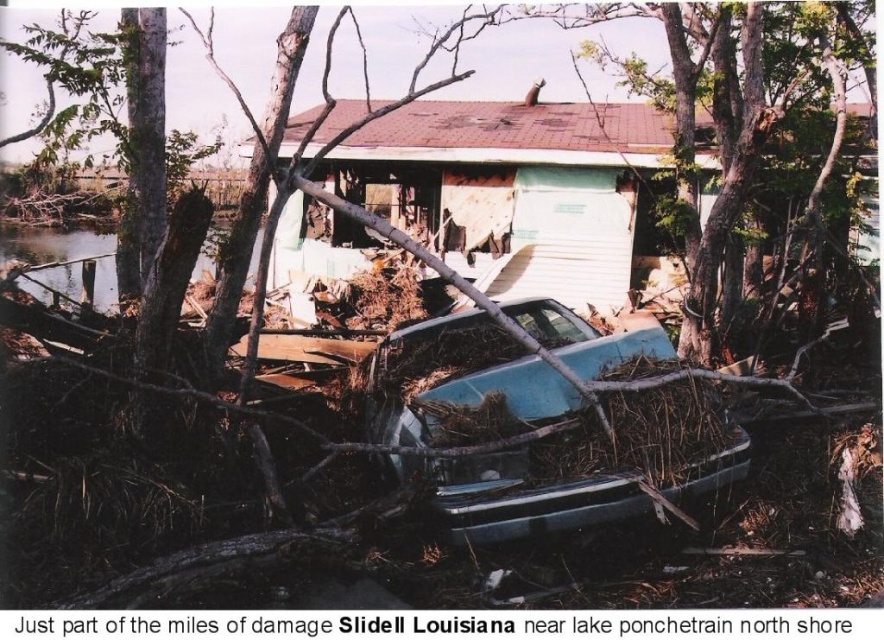
You are a rescue worker trying to locate the entrance to the white painted wood house at center. You have a map showing a point at coordinates (514, 188). Where is this point located on the house?

The point at coordinates (514, 188) is on the white painted wood house at center, so it is located on the house itself.

You are a rescue worker trying to reach the teal matte car at center to check for survivors. There is a white painted wood house at center blocking your path. Which direction should you go to avoid the house and reach the car?

The white painted wood house at center is positioned on the left side of the teal matte car at center, so to avoid the house and reach the car, you should go to the right side of the teal matte car at center.

You are a rescue worker assessing the scene. You see the white painted wood house at center and the teal matte car at center. Which object is taller? Please explain based on the scene details.

The teal matte car at center is taller than the white painted wood house at center according to the scene description.